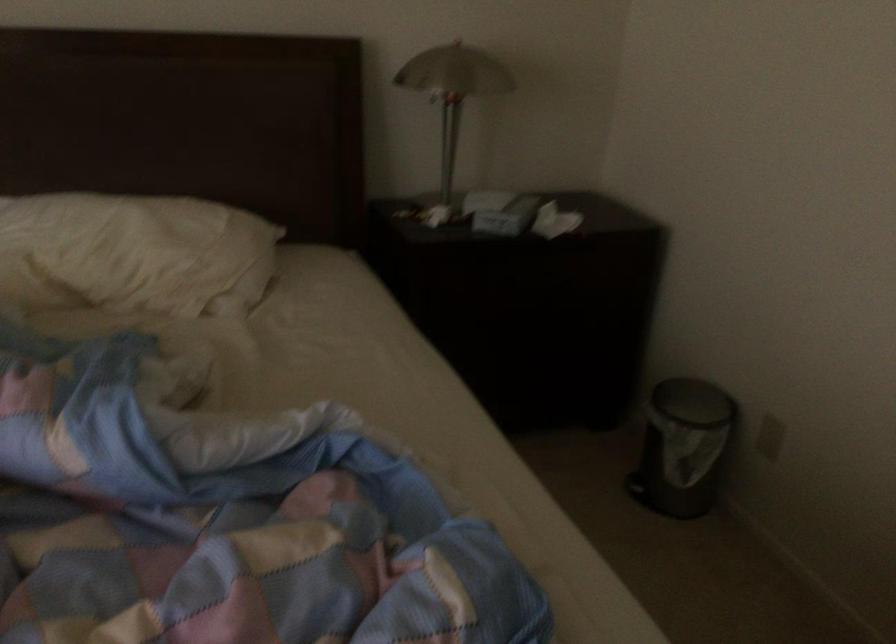
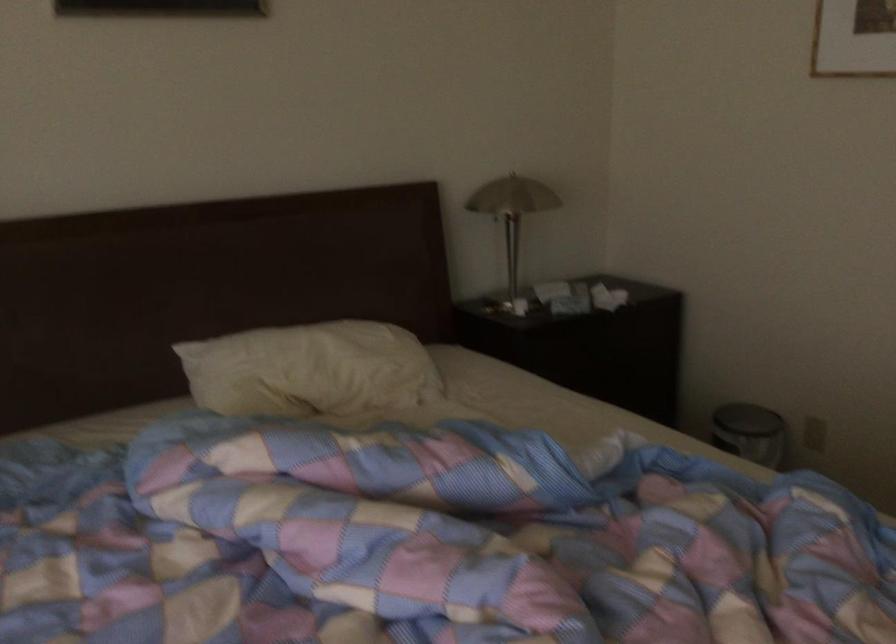
Locate, in the second image, the point that corresponds to point 444,100 in the first image.

(512, 213)